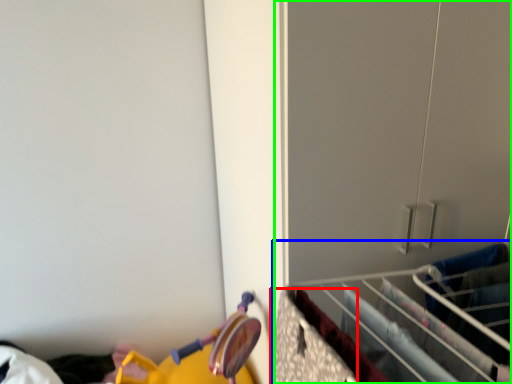
Question: Considering the real-world distances, which object is farthest from drawer (highlighted by a red box)? closet (highlighted by a blue box) or closet (highlighted by a green box)?

Choices:
 (A) closet
 (B) closet

Answer: (B)